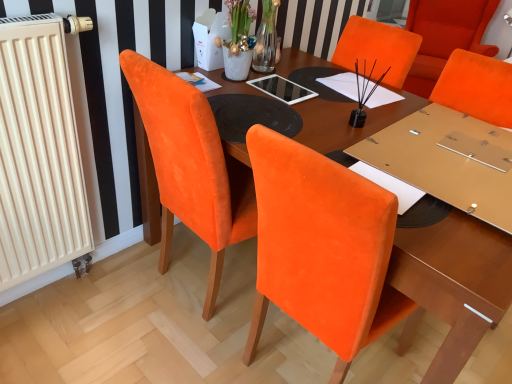
Find the location of a particular element. This screenshot has width=512, height=384. empty space that is ontop of wooden table at center is located at coordinates (385, 142).